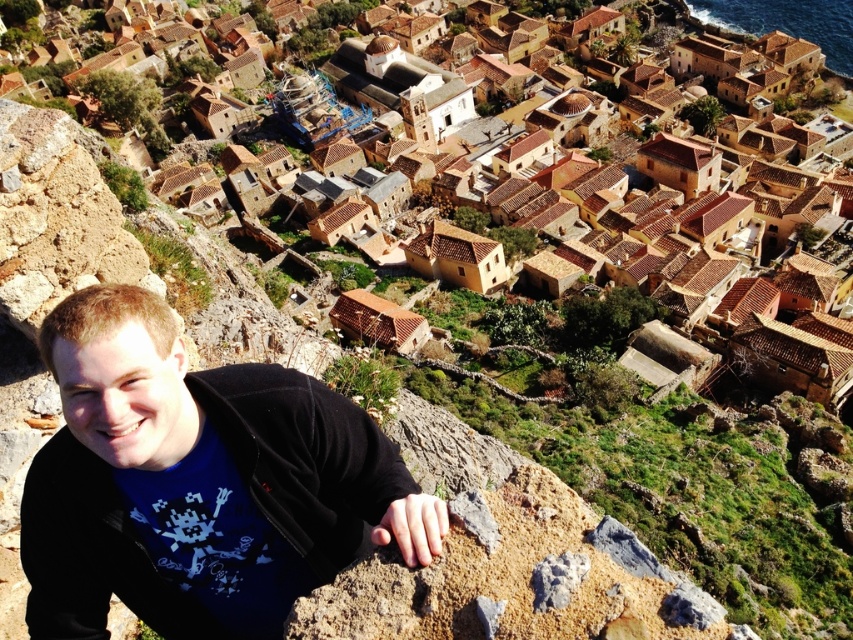
Which of these two, black matte jacket at lower left or brown clay village at lower left, stands shorter?

black matte jacket at lower left

Is black matte jacket at lower left above brown clay village at lower left?

No, black matte jacket at lower left is not above brown clay village at lower left.

Where is `black matte jacket at lower left`? This screenshot has height=640, width=853. black matte jacket at lower left is located at coordinates (196, 483).